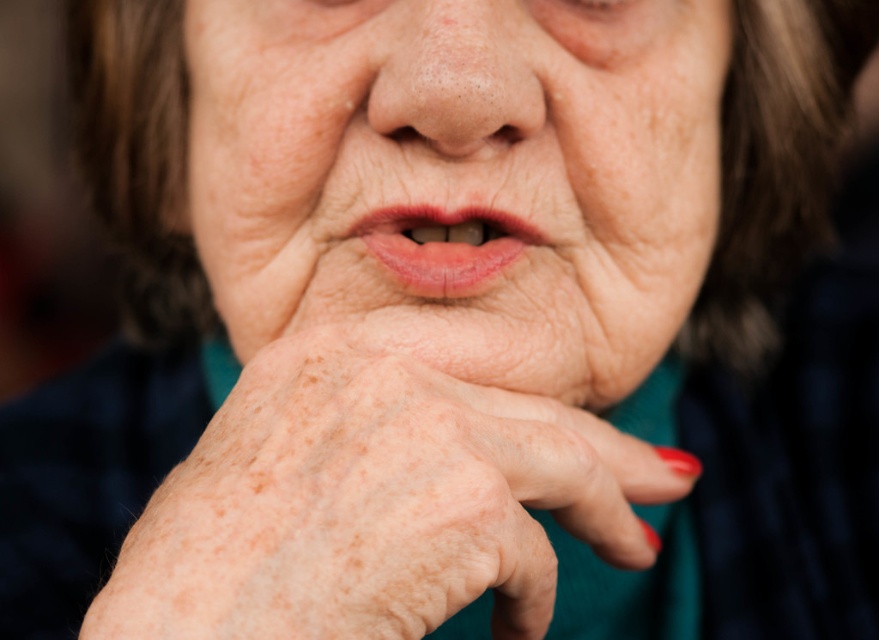
Can you confirm if dry skin at center is positioned above pink glossy lips at center?

Correct, dry skin at center is located above pink glossy lips at center.

Is dry skin at center to the left of pink glossy lips at center from the viewer's perspective?

In fact, dry skin at center is to the right of pink glossy lips at center.

Which is behind, point (654, 72) or point (449, 252)?

The point (654, 72) is more distant.

Locate an element on the screen. Image resolution: width=879 pixels, height=640 pixels. dry skin at center is located at coordinates (460, 179).

Consider the image. Which is more to the left, dry skin hand at center or pink glossy lips at center?

From the viewer's perspective, pink glossy lips at center appears more on the left side.

Who is more distant from viewer, (416, 387) or (434, 234)?

Point (434, 234)

Who is more distant from viewer, (x=323, y=586) or (x=480, y=268)?

The point (x=480, y=268) is behind.

Find the location of a particular element. This screenshot has width=879, height=640. dry skin hand at center is located at coordinates (375, 504).

Consider the image. Which of these two, dry skin wrinkle at center or pink glossy lips at center, stands taller?

With more height is dry skin wrinkle at center.

Can you confirm if dry skin wrinkle at center is bigger than pink glossy lips at center?

Yes.

Locate an element on the screen. Image resolution: width=879 pixels, height=640 pixels. dry skin wrinkle at center is located at coordinates click(x=589, y=317).

The width and height of the screenshot is (879, 640). I want to click on dry skin wrinkle at center, so click(x=589, y=317).